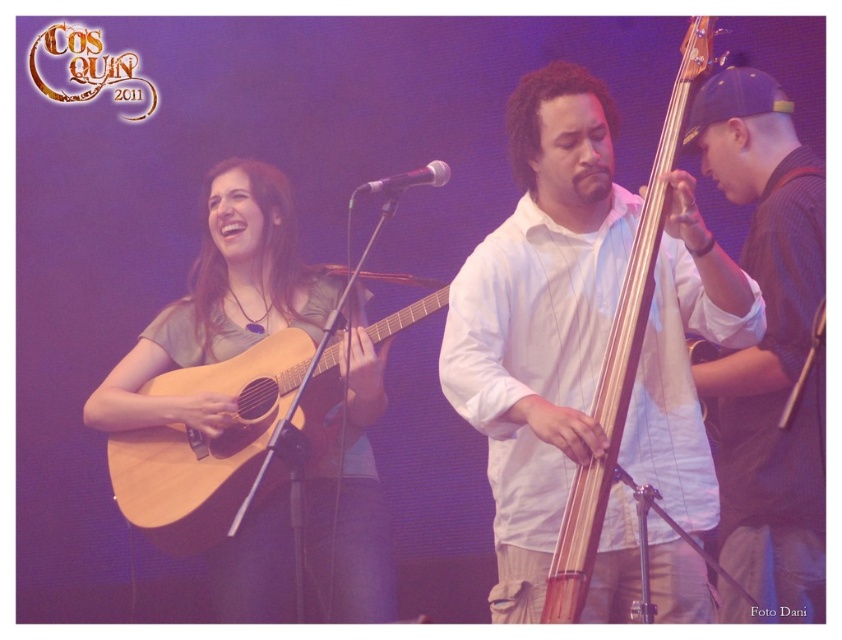
Question: Which point is farther to the camera?

Choices:
 (A) natural wood acoustic guitar at center
 (B) black textured shirt at right

Answer: (B)

Question: Does black textured shirt at right lie behind natural wood acoustic guitar at left?

Choices:
 (A) yes
 (B) no

Answer: (B)

Question: Among these objects, which one is farthest from the camera?

Choices:
 (A) metallic silver microphone at center
 (B) natural wood acoustic guitar at center
 (C) natural wood acoustic guitar at left
 (D) black textured shirt at right

Answer: (C)

Question: Can you confirm if black textured shirt at right is positioned to the left of natural wood acoustic guitar at center?

Choices:
 (A) no
 (B) yes

Answer: (A)

Question: Which of the following is the farthest from the observer?

Choices:
 (A) (803, 566)
 (B) (369, 189)
 (C) (646, 284)
 (D) (308, 403)

Answer: (D)

Question: Is black textured shirt at right further to the viewer compared to natural wood acoustic guitar at center?

Choices:
 (A) no
 (B) yes

Answer: (B)